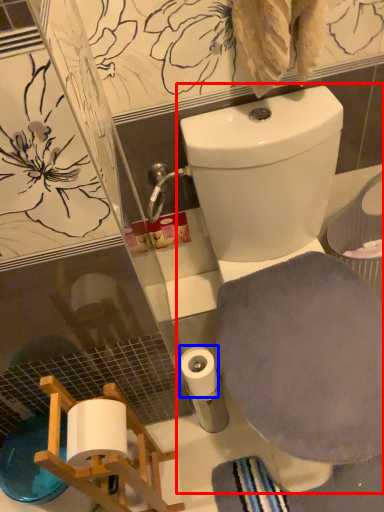
Question: Which object appears farthest to the camera in this image, toilet (highlighted by a red box) or toilet paper (highlighted by a blue box)?

Choices:
 (A) toilet
 (B) toilet paper

Answer: (B)